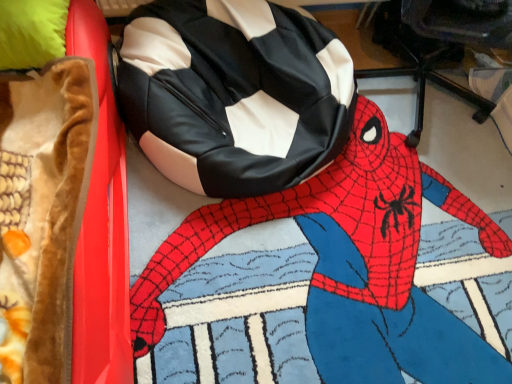
Question: Can you confirm if black leather bean bag at upper center is thinner than black leather bean bag chair at center?

Choices:
 (A) yes
 (B) no

Answer: (B)

Question: From the image's perspective, would you say black leather bean bag at upper center is positioned over black leather bean bag chair at center?

Choices:
 (A) yes
 (B) no

Answer: (B)

Question: From a real-world perspective, is black leather bean bag at upper center positioned under black leather bean bag chair at center based on gravity?

Choices:
 (A) yes
 (B) no

Answer: (A)

Question: Is black leather bean bag at upper center to the right of black leather bean bag chair at center from the viewer's perspective?

Choices:
 (A) yes
 (B) no

Answer: (A)

Question: Could black leather bean bag chair at center be considered to be inside black leather bean bag at upper center?

Choices:
 (A) no
 (B) yes

Answer: (A)

Question: Is black leather bean bag at upper center taller or shorter than black leather bean bag chair at center?

Choices:
 (A) tall
 (B) short

Answer: (B)

Question: Do you think black leather bean bag at upper center is within black leather bean bag chair at center, or outside of it?

Choices:
 (A) outside
 (B) inside

Answer: (A)

Question: From the image's perspective, is black leather bean bag at upper center located above or below black leather bean bag chair at center?

Choices:
 (A) above
 (B) below

Answer: (B)

Question: Relative to black leather bean bag chair at center, is black leather bean bag at upper center in front or behind?

Choices:
 (A) behind
 (B) front

Answer: (B)

Question: From a real-world perspective, is velvet brown blanket at left physically located above or below black leather bean bag at upper center?

Choices:
 (A) above
 (B) below

Answer: (A)

Question: From the image's perspective, is velvet brown blanket at left above or below black leather bean bag at upper center?

Choices:
 (A) above
 (B) below

Answer: (A)

Question: Would you say velvet brown blanket at left is to the left or to the right of black leather bean bag at upper center in the picture?

Choices:
 (A) right
 (B) left

Answer: (B)

Question: Is point (53, 294) closer or farther from the camera than point (501, 357)?

Choices:
 (A) farther
 (B) closer

Answer: (B)

Question: From their relative heights in the image, would you say black leather bean bag at upper center is taller or shorter than velvet brown blanket at left?

Choices:
 (A) short
 (B) tall

Answer: (A)

Question: Looking at their shapes, would you say black leather bean bag at upper center is wider or thinner than velvet brown blanket at left?

Choices:
 (A) wide
 (B) thin

Answer: (B)